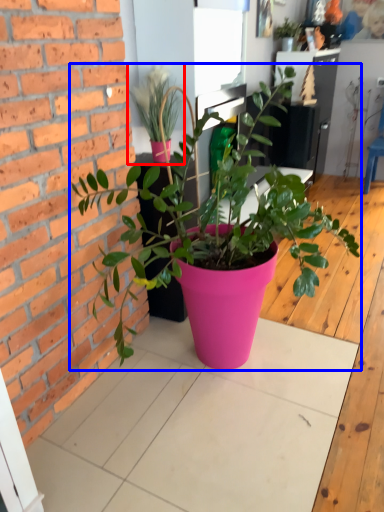
Question: Which of the following is the closest to the observer, houseplant (highlighted by a red box) or houseplant (highlighted by a blue box)?

Choices:
 (A) houseplant
 (B) houseplant

Answer: (B)